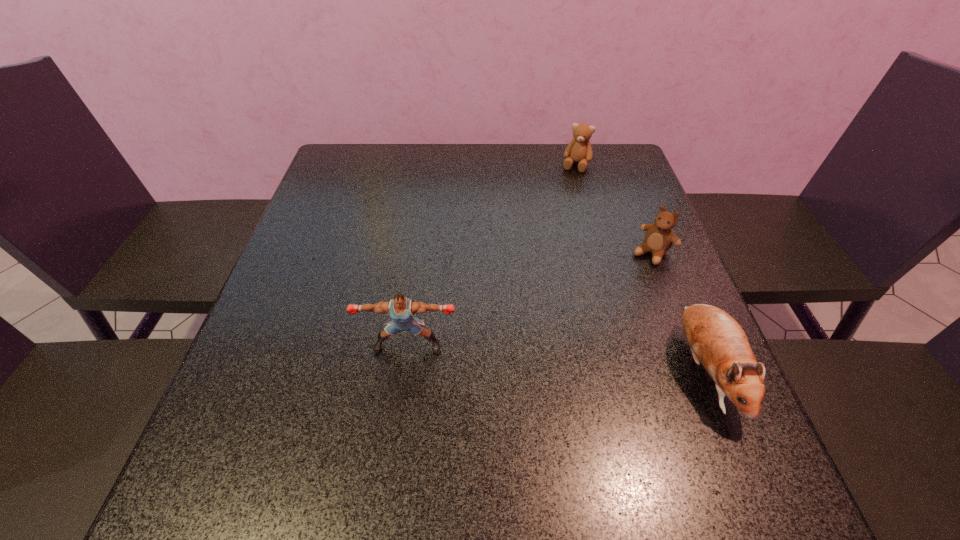
Where is `empty location between the tallest object and the hamster`? Image resolution: width=960 pixels, height=540 pixels. empty location between the tallest object and the hamster is located at coordinates (557, 358).

Where is `free space between the puncher and the hamster`? free space between the puncher and the hamster is located at coordinates (557, 358).

Where is `free spot between the puncher and the left teddy bear`? The width and height of the screenshot is (960, 540). free spot between the puncher and the left teddy bear is located at coordinates (492, 255).

At what (x,y) coordinates should I click in order to perform the action: click on free space between the tallest object and the farther teddy bear. Please return your answer as a coordinate pair (x, y). The image size is (960, 540). Looking at the image, I should click on (492, 255).

Identify the location of blank region between the leftmost object and the nearer teddy bear. The width and height of the screenshot is (960, 540). (530, 299).

Image resolution: width=960 pixels, height=540 pixels. What are the coordinates of `free space between the hamster and the right teddy bear` in the screenshot? It's located at (679, 312).

Where is `vacant area between the farther teddy bear and the nearer teddy bear`? The image size is (960, 540). vacant area between the farther teddy bear and the nearer teddy bear is located at coordinates point(614,209).

Locate an element on the screen. The height and width of the screenshot is (540, 960). object that can be found as the closest to the farthest object is located at coordinates (659, 237).

Select which object appears as the second closest to the hamster. Please provide its 2D coordinates. Your answer should be formatted as a tuple, i.e. [(x, y)], where the tuple contains the x and y coordinates of a point satisfying the conditions above.

[(401, 310)]